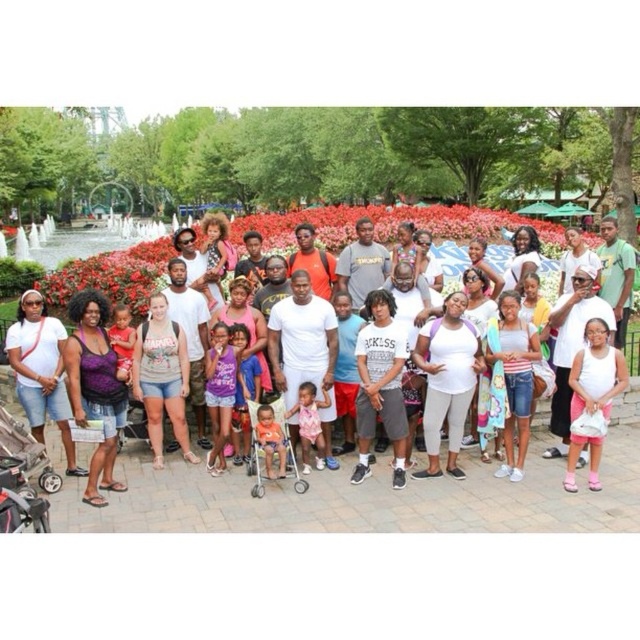
You are a photographer trying to capture a group photo of the black plastic baby carriage at lower left and the green cotton shirt at center. The minimum distance required for your camera to focus clearly is 150 feet. Based on the scene, will your camera be able to focus on both subjects simultaneously?

The black plastic baby carriage at lower left is 143.65 feet from the green cotton shirt at center. Since the distance between them is less than the camera minimum focusing distance of 150 feet, the camera cannot focus on both subjects simultaneously.

You are standing at the center of the park where the group is gathered. You want to find the black plastic baby carriage at lower left. Based on its 2D coordinates, in which direction should you look to locate it?

The black plastic baby carriage at lower left is located at coordinates point (22, 477), which means you should look to the lower left direction to find it.

You are standing at the point with coordinates point (289,320) and want to move to the point with coordinates point (465,232). Based on the scene description, will you be moving forward or backward?

Point (465,232) is behind point (289,320), so moving to it from your current position would mean moving backward.